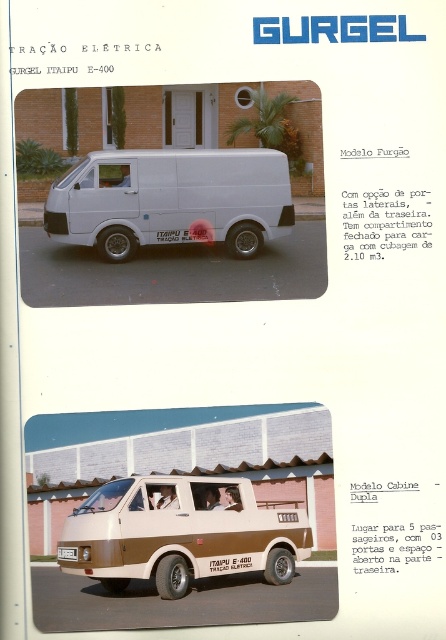
What do you see at coordinates (172, 198) in the screenshot? Image resolution: width=446 pixels, height=640 pixels. I see `white matte van at center` at bounding box center [172, 198].

Between white matte van at center and white plastic license plate at bottom center, which one is positioned lower?

white plastic license plate at bottom center is below.

Between point (99, 173) and point (75, 554), which one is positioned in front?

Point (75, 554)

Where is `white matte van at center`? The image size is (446, 640). white matte van at center is located at coordinates (172, 198).

Find the location of a particular element. The width and height of the screenshot is (446, 640). brown matte van at center is located at coordinates (182, 532).

Between point (189, 524) and point (243, 248), which one is positioned behind?

The point (243, 248) is behind.

Who is more distant from viewer, (x=119, y=564) or (x=218, y=157)?

The point (x=218, y=157) is behind.

This screenshot has height=640, width=446. In order to click on brown matte van at center in this screenshot , I will do `click(182, 532)`.

Does brown matte van at center lie in front of white plastic license plate at bottom center?

That is True.

Is brown matte van at center below white plastic license plate at bottom center?

No.

Who is more forward, (170, 493) or (66, 556)?

Positioned in front is point (66, 556).

Locate an element on the screen. The height and width of the screenshot is (640, 446). brown matte van at center is located at coordinates (182, 532).